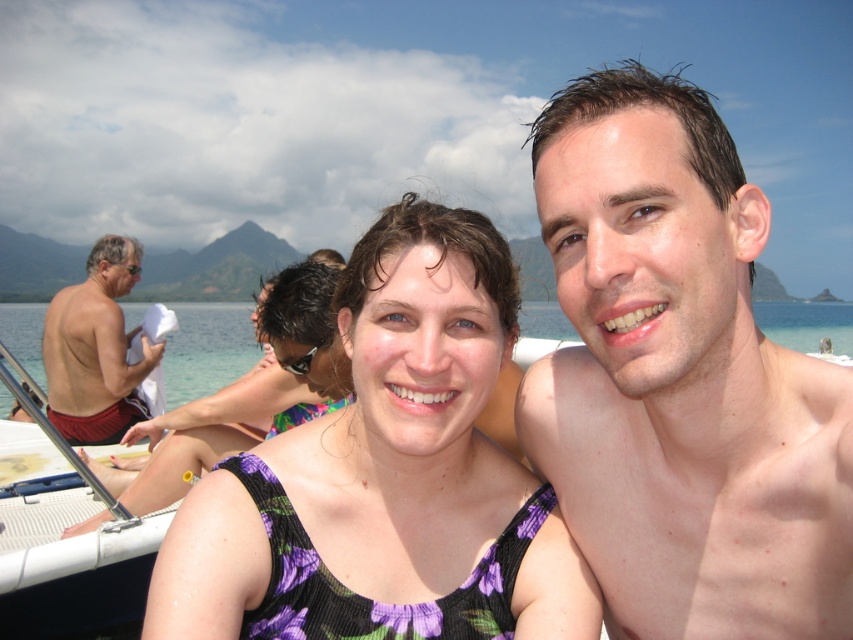
You are a photographer trying to capture a photo of the purple floral tank top at center and the shiny red shorts at left. Which object should you focus on first if you want to ensure both are in the frame without moving the camera?

The purple floral tank top at center is shorter than the shiny red shorts at left, so you should focus on the shiny red shorts at left first to ensure both are in the frame.

You are a photographer trying to capture a photo of the purple floral tank top at center and the shiny red shorts at left. Based on their positions, which one should you focus on first if you want to ensure both are in the frame without moving the camera?

The purple floral tank top at center is located below the shiny red shorts at left. Since the purple floral tank top is lower, you should focus on the shiny red shorts at left first to ensure the camera frame includes both items from top to bottom.

You are a photographer trying to capture a photo of the clear blue water at center and the shiny red shorts at left. Based on their positions, which object is closer to the camera?

The clear blue water at center is much taller as shiny red shorts at left, meaning it is closer to the camera.